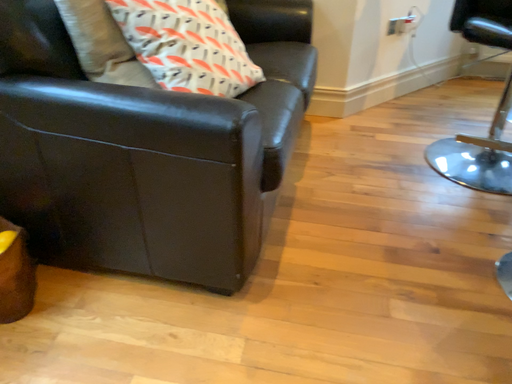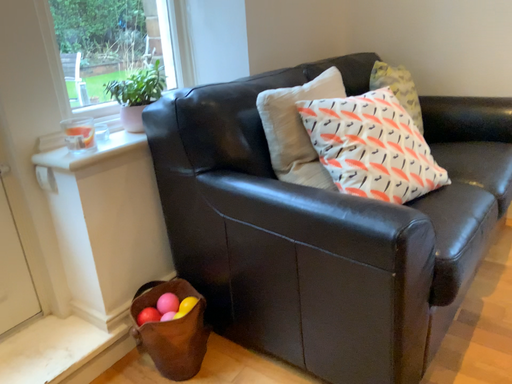
Question: How did the camera likely rotate when shooting the video?

Choices:
 (A) rotated right
 (B) rotated left

Answer: (B)